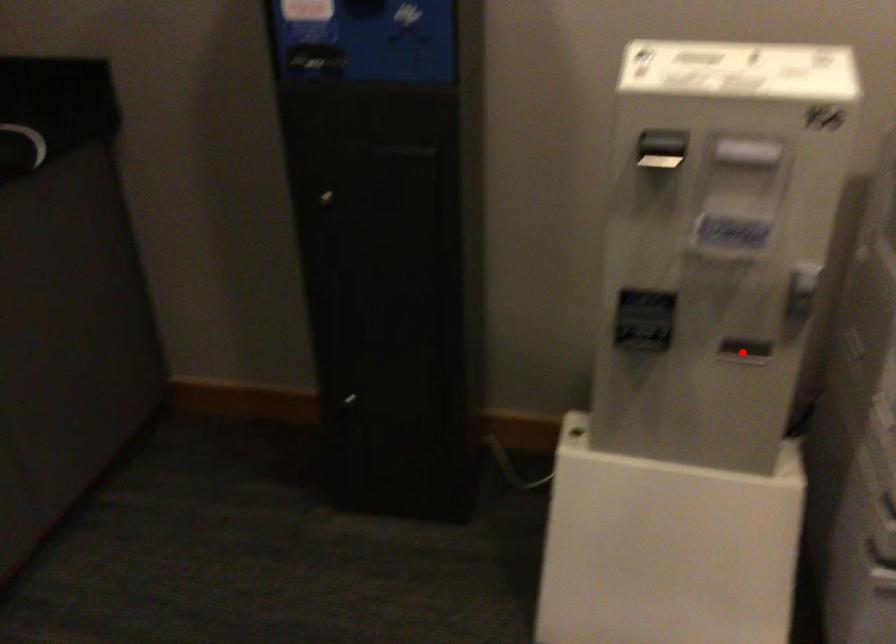
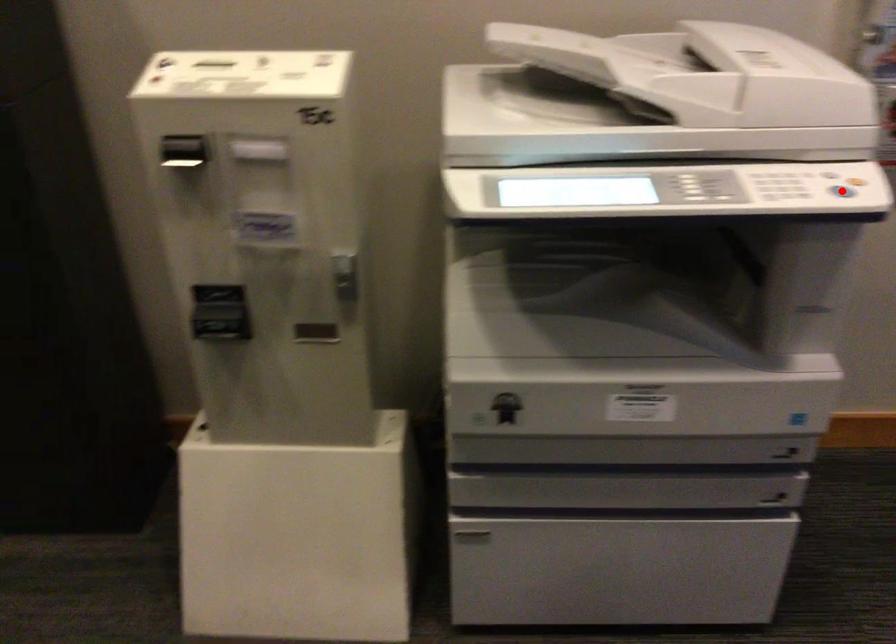
I am providing you with two images of the same scene from different viewpoints. A red point is marked on the first image and another point is marked on the second image. Are the points marked in image1 and image2 representing the same 3D position?

No